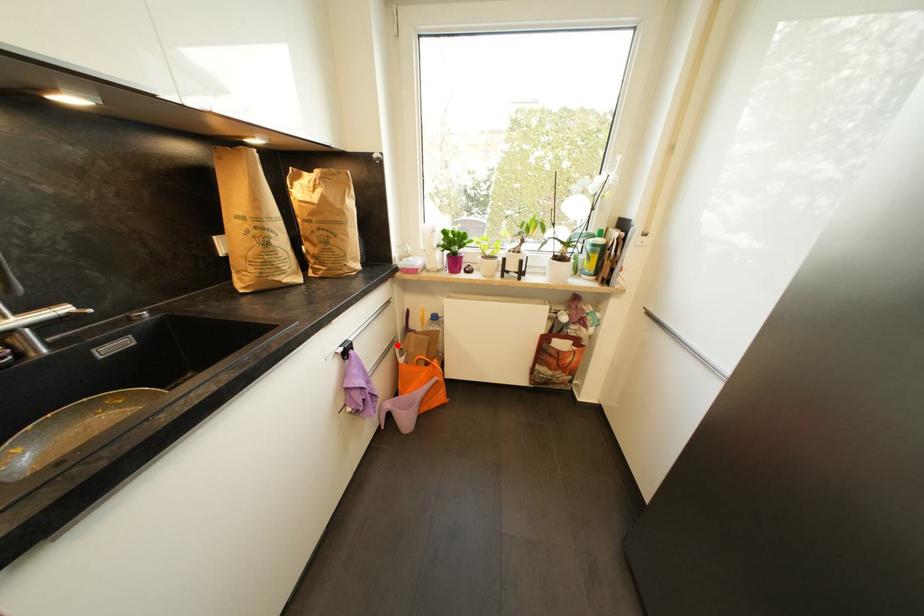
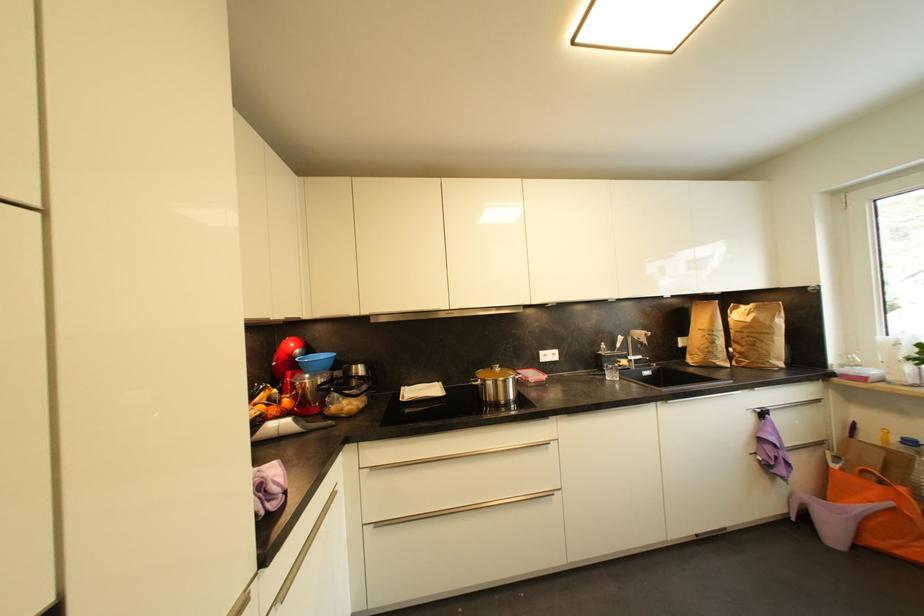
In the second image, find the point that corresponds to the highlighted location in the first image.

(825, 446)